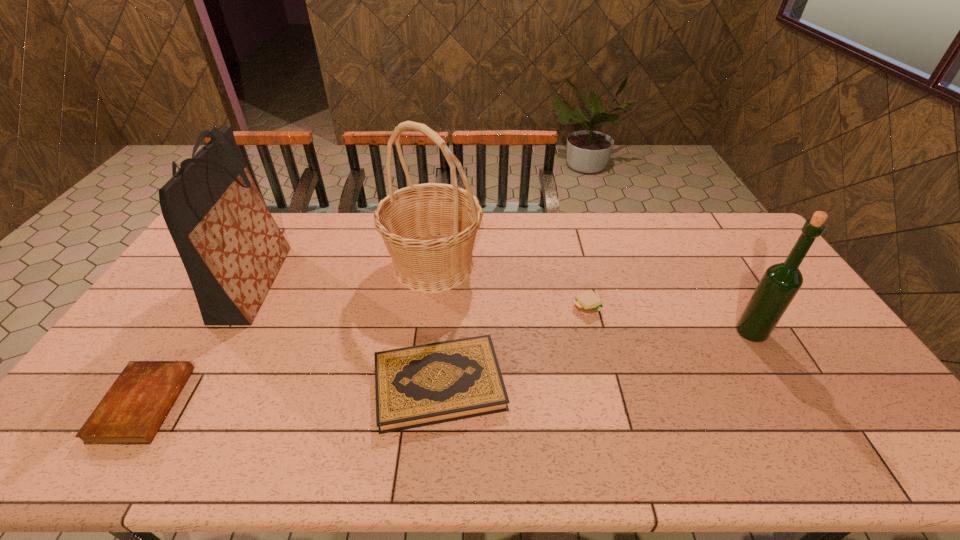
I want to click on vacant region at the right edge, so click(x=838, y=348).

Where is `free space between the shopping bag and the hardback book`? free space between the shopping bag and the hardback book is located at coordinates (347, 334).

In order to click on free space between the patty and the Bible in this screenshot , I will do `click(365, 355)`.

This screenshot has width=960, height=540. Find the location of `empty space that is in between the hardback book and the shopping bag`. empty space that is in between the hardback book and the shopping bag is located at coordinates (347, 334).

The width and height of the screenshot is (960, 540). What are the coordinates of `vacant area that lies between the rightmost object and the hardback book` in the screenshot? It's located at coord(595,359).

Locate an element on the screen. This screenshot has height=540, width=960. vacant space that is in between the hardback book and the Bible is located at coordinates (292, 394).

This screenshot has width=960, height=540. I want to click on free space between the hardback book and the patty, so click(x=513, y=346).

Find the location of a particular element. vacant region between the Bible and the patty is located at coordinates (365, 355).

Identify the location of unoccupied area between the shopping bag and the basket. (344, 274).

You are a GUI agent. You are given a task and a screenshot of the screen. Output one action in this format:
    pyautogui.click(x=<x>, y=<y>)
    Task: Click on the free area in between the shopping bag and the fifth object from left to right
    
    Given the screenshot: What is the action you would take?
    pyautogui.click(x=420, y=295)